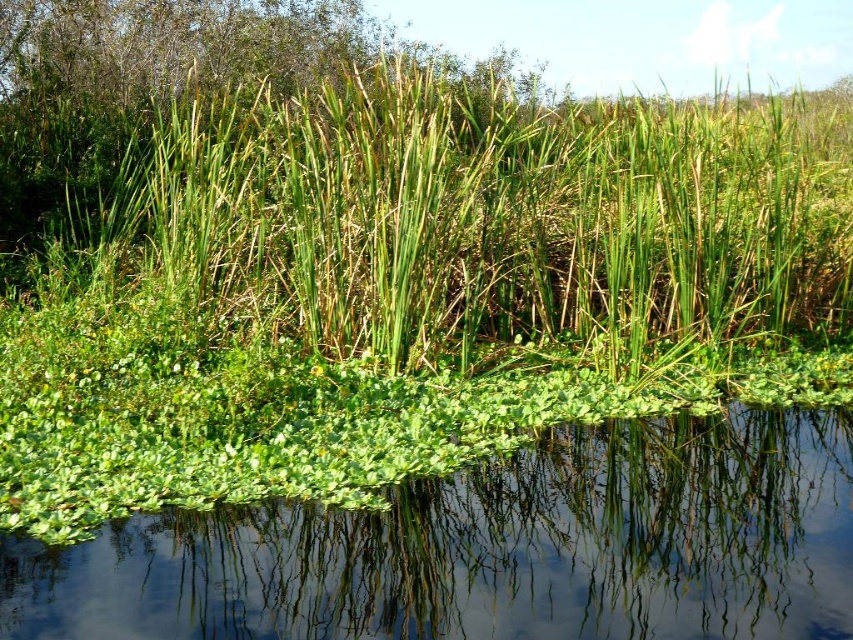
You are a frog trying to jump from a lily pad to a safe spot. You see the green grass at center and the green leafy water at center. Which one is higher and can you land on it?

The green grass at center is above the green leafy water at center, so the frog can jump to the green grass at center as it is higher.

You are a photographer positioned at the edge of the wetland and want to capture both the green grass at center and the green leafy water at center in your photo. Which object will appear closer to you in the photograph?

The green grass at center will appear closer to you in the photograph because it is positioned further to the viewer than the green leafy water at center, making it occupy a more prominent position in the foreground.